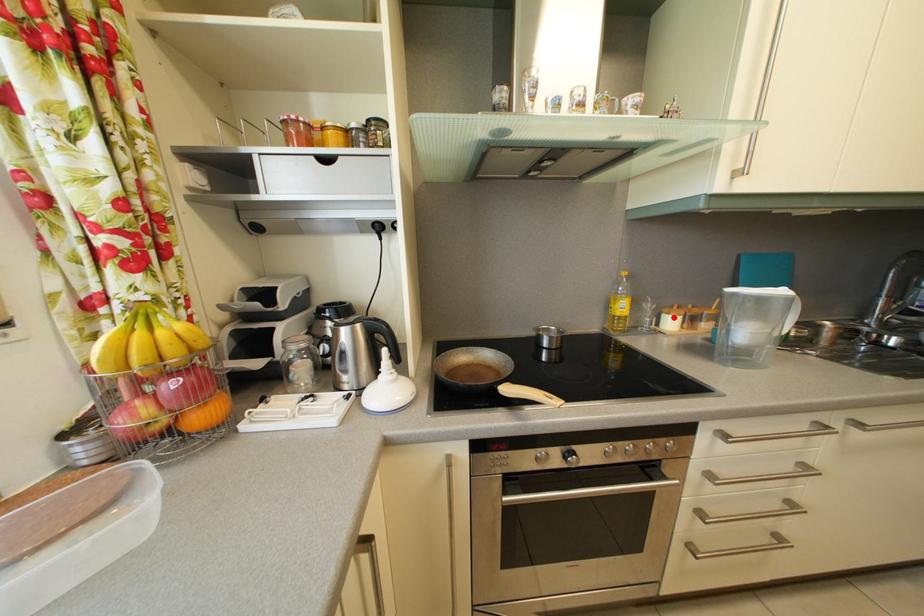
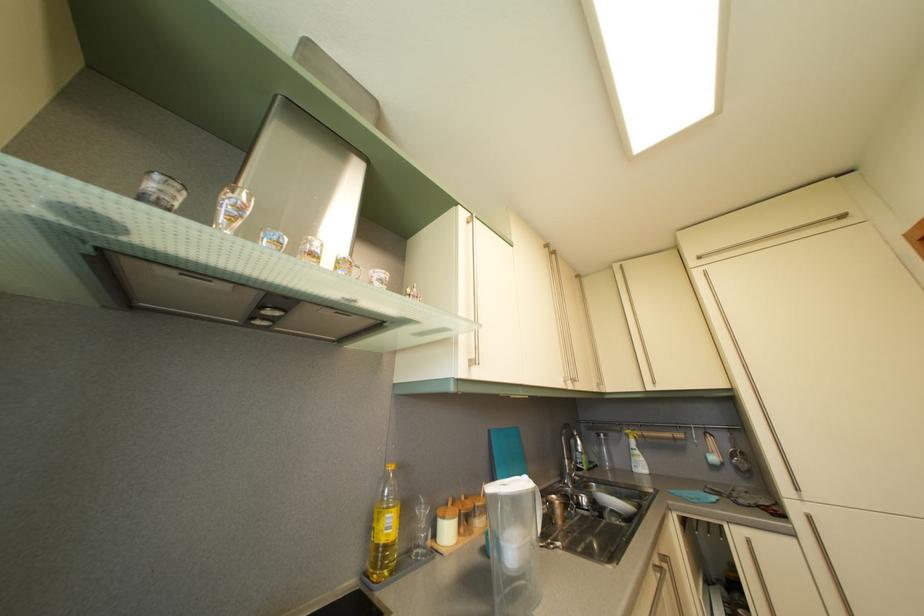
Question: I am providing you with two images of the same scene from different viewpoints. A red point is marked on the first image. Is the red point's position out of view in image 2?

Choices:
 (A) Yes
 (B) No

Answer: (B)